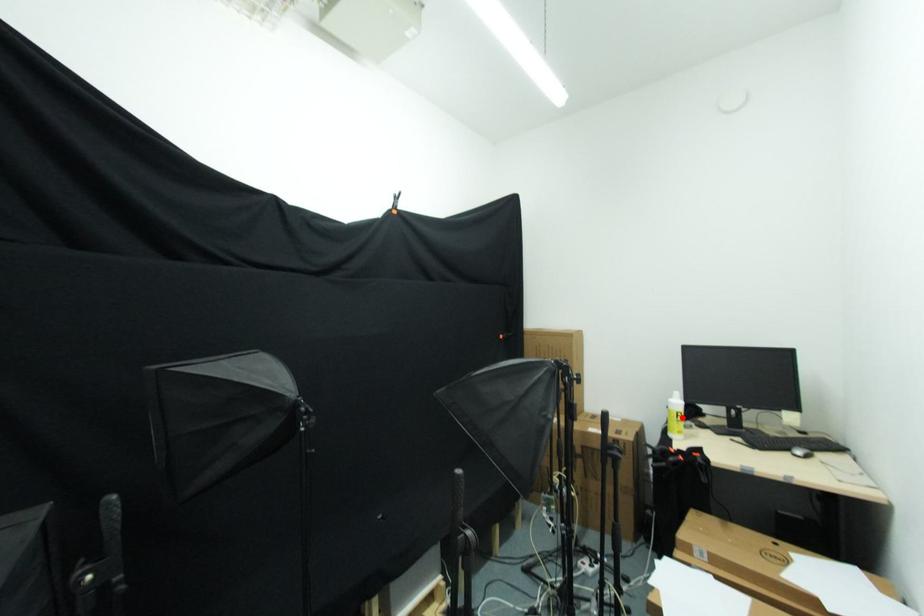
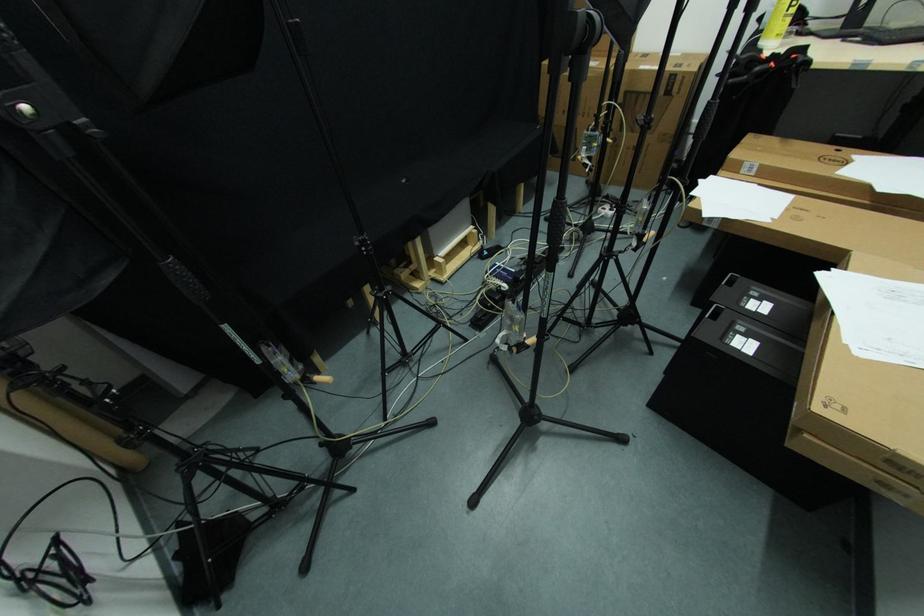
In the second image, find the point that corresponds to the highlighted location in the first image.

(796, 6)